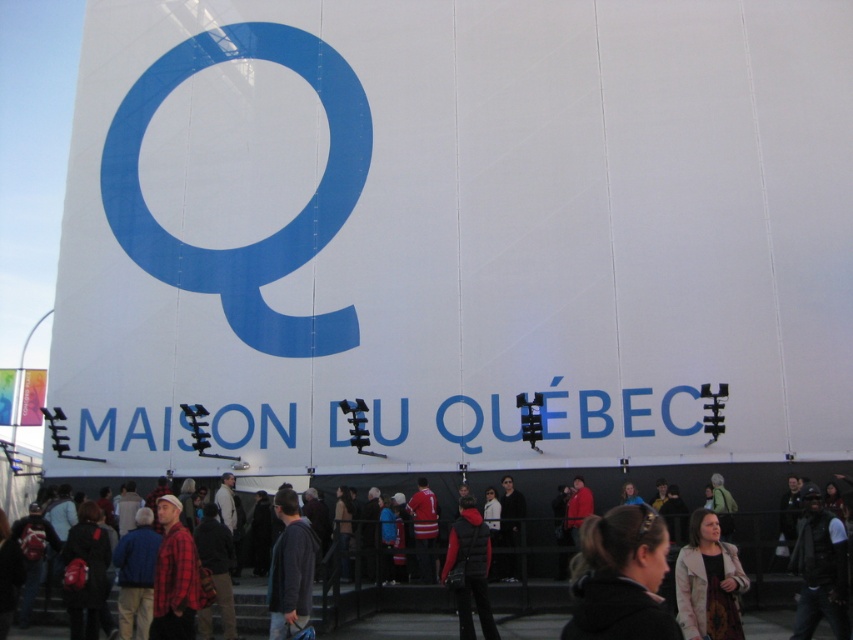
Image resolution: width=853 pixels, height=640 pixels. What are the coordinates of `dark blue leather jacket at lower right` in the screenshot? It's located at (820, 570).

Is dark blue leather jacket at lower right shorter than red fleece jacket at center?

Yes.

Where is `dark blue leather jacket at lower right`? This screenshot has height=640, width=853. dark blue leather jacket at lower right is located at coordinates (820, 570).

Which of these two, blue glossy letter q at center or red plaid shirt at lower left, stands shorter?

red plaid shirt at lower left is shorter.

This screenshot has height=640, width=853. Describe the element at coordinates (270, 234) in the screenshot. I see `blue glossy letter q at center` at that location.

Locate an element on the screen. blue glossy letter q at center is located at coordinates (270, 234).

Which is above, blue glossy letter q at center or dark gray sweater at center?

Positioned higher is blue glossy letter q at center.

Find the location of a particular element. Image resolution: width=853 pixels, height=640 pixels. blue glossy letter q at center is located at coordinates (270, 234).